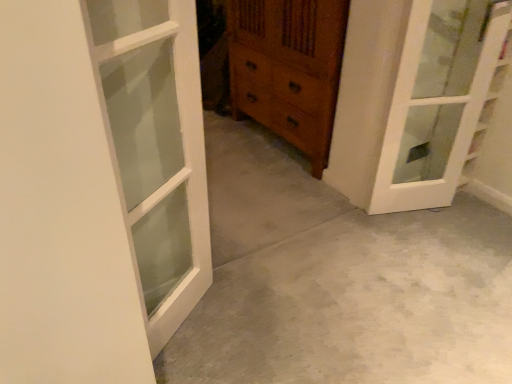
Question: Does white wood door at left, placed as the 1th door when sorted from front to back, have a lesser height compared to gray concrete at center?

Choices:
 (A) yes
 (B) no

Answer: (B)

Question: Is white wood door at left, placed as the 1th door when sorted from front to back, to the left of gray concrete at center from the viewer's perspective?

Choices:
 (A) yes
 (B) no

Answer: (A)

Question: Is the depth of white wood door at left, which appears as the second door when viewed from the back, greater than that of gray concrete at center?

Choices:
 (A) no
 (B) yes

Answer: (A)

Question: Is white wood door at left, the second door from the right, far from gray concrete at center?

Choices:
 (A) no
 (B) yes

Answer: (A)

Question: Considering the relative sizes of white wood door at left, placed as the 1th door when sorted from left to right, and gray concrete at center in the image provided, is white wood door at left, placed as the 1th door when sorted from left to right, bigger than gray concrete at center?

Choices:
 (A) yes
 (B) no

Answer: (B)

Question: Is white wood door at left, placed as the 1th door when sorted from front to back, oriented towards gray concrete at center?

Choices:
 (A) no
 (B) yes

Answer: (A)

Question: Is white wood door at left, placed as the 1th door when sorted from front to back, completely or partially inside gray concrete at center?

Choices:
 (A) no
 (B) yes

Answer: (A)

Question: Considering the relative positions of gray concrete at center and white wood door at left, placed as the 1th door when sorted from left to right, in the image provided, is gray concrete at center to the left of white wood door at left, placed as the 1th door when sorted from left to right, from the viewer's perspective?

Choices:
 (A) no
 (B) yes

Answer: (A)

Question: Considering the relative sizes of gray concrete at center and white wood door at left, the second door from the right, in the image provided, is gray concrete at center wider than white wood door at left, the second door from the right,?

Choices:
 (A) no
 (B) yes

Answer: (B)

Question: Is the depth of gray concrete at center less than that of white wood door at left, the second door from the right?

Choices:
 (A) no
 (B) yes

Answer: (A)

Question: Is gray concrete at center oriented towards white wood door at left, placed as the 1th door when sorted from left to right?

Choices:
 (A) yes
 (B) no

Answer: (B)

Question: Are gray concrete at center and white wood door at left, placed as the 1th door when sorted from left to right, located far from each other?

Choices:
 (A) no
 (B) yes

Answer: (A)

Question: Is there a large distance between wooden chest of drawers at center and white glass door at upper right, acting as the second door starting from the left?

Choices:
 (A) yes
 (B) no

Answer: (B)